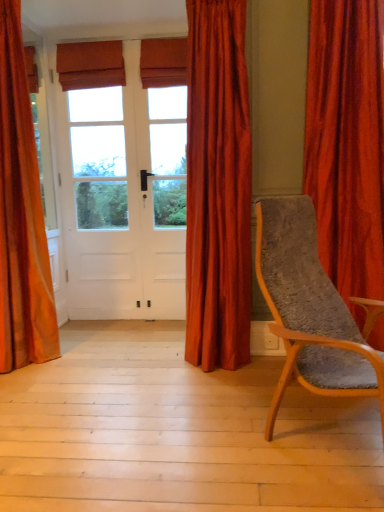
Find the location of `light wood floor at lower center`. light wood floor at lower center is located at coordinates (176, 432).

The height and width of the screenshot is (512, 384). What do you see at coordinates (176, 432) in the screenshot?
I see `light wood floor at lower center` at bounding box center [176, 432].

What do you see at coordinates (346, 145) in the screenshot?
I see `velvet orange curtain at right, the first curtain viewed from the right` at bounding box center [346, 145].

What are the coordinates of `white wood screen door at center` in the screenshot? It's located at (101, 204).

In the scene shown: Considering the sizes of objects satin red curtain at center, which is the 2th curtain in right-to-left order, and wooden textured chair at right in the image provided, who is shorter, satin red curtain at center, which is the 2th curtain in right-to-left order, or wooden textured chair at right?

wooden textured chair at right.

Based on their positions, is satin red curtain at center, positioned as the 2th curtain in left-to-right order, located to the left or right of wooden textured chair at right?

satin red curtain at center, positioned as the 2th curtain in left-to-right order, is to the left of wooden textured chair at right.

Which point is more distant from viewer, [221,24] or [321,392]?

Point [221,24]

Is the surface of satin red curtain at center, positioned as the 2th curtain in left-to-right order, in direct contact with wooden textured chair at right?

No.

From the image's perspective, which is above, light wood floor at lower center or satin red curtain at center, positioned as the 2th curtain in left-to-right order?

satin red curtain at center, positioned as the 2th curtain in left-to-right order, appears higher in the image.

Looking at this image, is light wood floor at lower center placed right next to satin red curtain at center, which is the 2th curtain in right-to-left order?

light wood floor at lower center is not next to satin red curtain at center, which is the 2th curtain in right-to-left order, and they're not touching.

Is light wood floor at lower center outside of satin red curtain at center, positioned as the 2th curtain in left-to-right order?

Yes, light wood floor at lower center is located beyond the bounds of satin red curtain at center, positioned as the 2th curtain in left-to-right order.

Between point (169, 446) and point (218, 133), which one is positioned in front?

The point (169, 446) is in front.

What are the coordinates of `curtain that is the 1st object above the satin red curtain at center, which is the 2th curtain in right-to-left order (from a real-world perspective)` in the screenshot? It's located at pos(21,215).

Is point (191, 231) farther from camera compared to point (10, 71)?

Yes.

Could you tell me if satin red curtain at center, which is the 2th curtain in right-to-left order, is turned towards velvet orange curtain at left, the first curtain in the left-to-right sequence?

No, satin red curtain at center, which is the 2th curtain in right-to-left order, is not oriented towards velvet orange curtain at left, the first curtain in the left-to-right sequence.

Is light wood floor at lower center inside or outside of velvet orange curtain at left, the first curtain in the left-to-right sequence?

light wood floor at lower center exists outside the volume of velvet orange curtain at left, the first curtain in the left-to-right sequence.

Locate an element on the screen. porch in front of the velvet orange curtain at left, positioned as the 3th curtain in right-to-left order is located at coordinates (176, 432).

Is light wood floor at lower center facing away from velvet orange curtain at left, the first curtain in the left-to-right sequence?

No, light wood floor at lower center is not facing the opposite direction of velvet orange curtain at left, the first curtain in the left-to-right sequence.

How far apart are light wood floor at lower center and wooden textured chair at right?

light wood floor at lower center and wooden textured chair at right are 22.86 inches apart from each other.

Is light wood floor at lower center looking in the opposite direction of wooden textured chair at right?

No, light wood floor at lower center's orientation is not away from wooden textured chair at right.

In the scene shown: Is light wood floor at lower center not within wooden textured chair at right?

That's correct, light wood floor at lower center is outside of wooden textured chair at right.

Would you say light wood floor at lower center is to the left or to the right of wooden textured chair at right in the picture?

light wood floor at lower center is positioned on wooden textured chair at right's left side.

This screenshot has width=384, height=512. I want to click on screen door above the wooden textured chair at right (from a real-world perspective), so click(101, 204).

In terms of width, does white wood screen door at center look wider or thinner when compared to wooden textured chair at right?

Clearly, white wood screen door at center has less width compared to wooden textured chair at right.

Which of these two, white wood screen door at center or wooden textured chair at right, is smaller?

white wood screen door at center is smaller.

From the image's perspective, is white wood screen door at center below wooden textured chair at right?

Incorrect, from the image's perspective, white wood screen door at center is higher than wooden textured chair at right.

Considering the relative sizes of wooden textured chair at right and satin red curtain at center, positioned as the 2th curtain in left-to-right order, in the image provided, is wooden textured chair at right wider than satin red curtain at center, positioned as the 2th curtain in left-to-right order,?

Indeed, wooden textured chair at right has a greater width compared to satin red curtain at center, positioned as the 2th curtain in left-to-right order.

Which is more to the right, wooden textured chair at right or satin red curtain at center, positioned as the 2th curtain in left-to-right order?

wooden textured chair at right.

Is the depth of wooden textured chair at right greater than that of satin red curtain at center, which is the 2th curtain in right-to-left order?

No, wooden textured chair at right is closer to the viewer.

Between wooden textured chair at right and satin red curtain at center, which is the 2th curtain in right-to-left order, which one has more height?

satin red curtain at center, which is the 2th curtain in right-to-left order, is taller.

From the image's perspective, starting from the wooden textured chair at right, which curtain is the 1st one above? Please provide its 2D coordinates.

[(218, 187)]

Locate an element on the screen. This screenshot has height=512, width=384. porch in front of the satin red curtain at center, positioned as the 2th curtain in left-to-right order is located at coordinates (176, 432).

Looking at the image, which one is located further to satin red curtain at center, which is the 2th curtain in right-to-left order, light wood floor at lower center or wooden textured chair at right?

The object further to satin red curtain at center, which is the 2th curtain in right-to-left order, is light wood floor at lower center.

Estimate the real-world distances between objects in this image. Which object is closer to light wood floor at lower center, velvet orange curtain at right, arranged as the 3th curtain when viewed from the left, or satin red curtain at center, positioned as the 2th curtain in left-to-right order?

Among the two, satin red curtain at center, positioned as the 2th curtain in left-to-right order, is located nearer to light wood floor at lower center.

When comparing their distances from satin red curtain at center, which is the 2th curtain in right-to-left order, does velvet orange curtain at right, the first curtain viewed from the right, or white wood screen door at center seem closer?

velvet orange curtain at right, the first curtain viewed from the right, is closer to satin red curtain at center, which is the 2th curtain in right-to-left order.

Based on their spatial positions, is white wood screen door at center or velvet orange curtain at right, arranged as the 3th curtain when viewed from the left, further from velvet orange curtain at left, the first curtain in the left-to-right sequence?

The object further to velvet orange curtain at left, the first curtain in the left-to-right sequence, is velvet orange curtain at right, arranged as the 3th curtain when viewed from the left.

Based on their spatial positions, is velvet orange curtain at right, arranged as the 3th curtain when viewed from the left, or velvet orange curtain at left, positioned as the 3th curtain in right-to-left order, further from light wood floor at lower center?

The object further to light wood floor at lower center is velvet orange curtain at right, arranged as the 3th curtain when viewed from the left.

Based on their spatial positions, is velvet orange curtain at left, the first curtain in the left-to-right sequence, or velvet orange curtain at right, the first curtain viewed from the right, further from light wood floor at lower center?

velvet orange curtain at right, the first curtain viewed from the right.

Considering their positions, is wooden textured chair at right positioned further to light wood floor at lower center than white wood screen door at center?

Based on the image, white wood screen door at center appears to be further to light wood floor at lower center.

Which object lies further to the anchor point velvet orange curtain at right, arranged as the 3th curtain when viewed from the left, white wood screen door at center or satin red curtain at center, positioned as the 2th curtain in left-to-right order?

white wood screen door at center is further to velvet orange curtain at right, arranged as the 3th curtain when viewed from the left.

Find the location of a particular element. The image size is (384, 512). porch located between wooden textured chair at right and white wood screen door at center in the depth direction is located at coordinates (176, 432).

In order to click on porch between velvet orange curtain at left, the first curtain in the left-to-right sequence, and velvet orange curtain at right, the first curtain viewed from the right in this screenshot , I will do `click(176, 432)`.

Image resolution: width=384 pixels, height=512 pixels. In order to click on curtain situated between white wood screen door at center and velvet orange curtain at right, the first curtain viewed from the right, from left to right in this screenshot , I will do `click(218, 187)`.

Find the location of a particular element. The width and height of the screenshot is (384, 512). porch located between velvet orange curtain at left, positioned as the 3th curtain in right-to-left order, and wooden textured chair at right in the left-right direction is located at coordinates (176, 432).